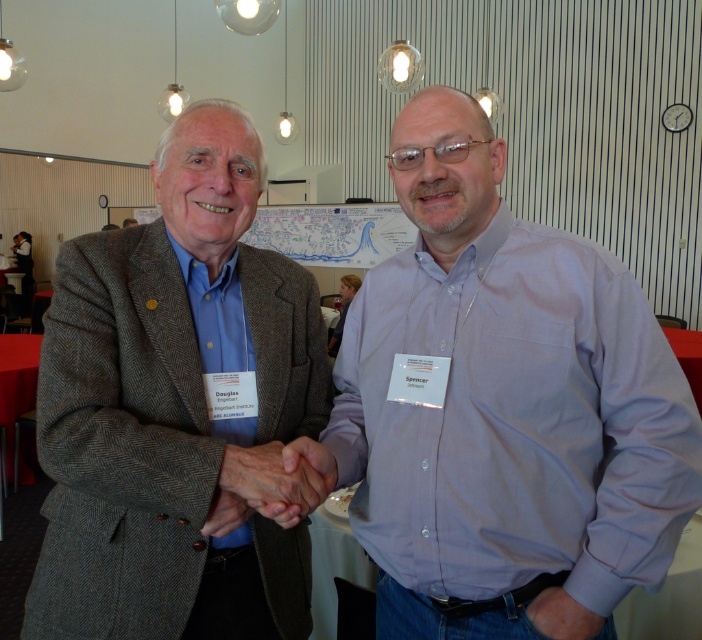
You are attending a conference and need to locate the Engelbart Institute booth. You see the gray herringbone blazer at center and the white paper map at center. Which object should you approach first to get directions?

You should approach the white paper map at center first since the gray herringbone blazer at center is to the right of it, meaning the map is closer to your current position.

You are a photographer standing at the white paper map at center and want to take a photo of the smooth skin handshake at center. Your camera has a minimum focusing distance of 5 meters. Can you take a clear photo without moving your position?

The distance between the white paper map at center and the smooth skin handshake at center is 5.29 meters. Since the camera requires at least 5 meters to focus, you can take a clear photo without moving your position.

You are a photographer in the room and want to capture a photo where the white paper map at center is clearly visible without being blocked by the smooth skin handshake at center. Given their sizes, is this possible?

The white paper map at center is larger in size than the smooth skin handshake at center, so it is possible to position the camera angle such that the smaller handshake does not obstruct the larger map.